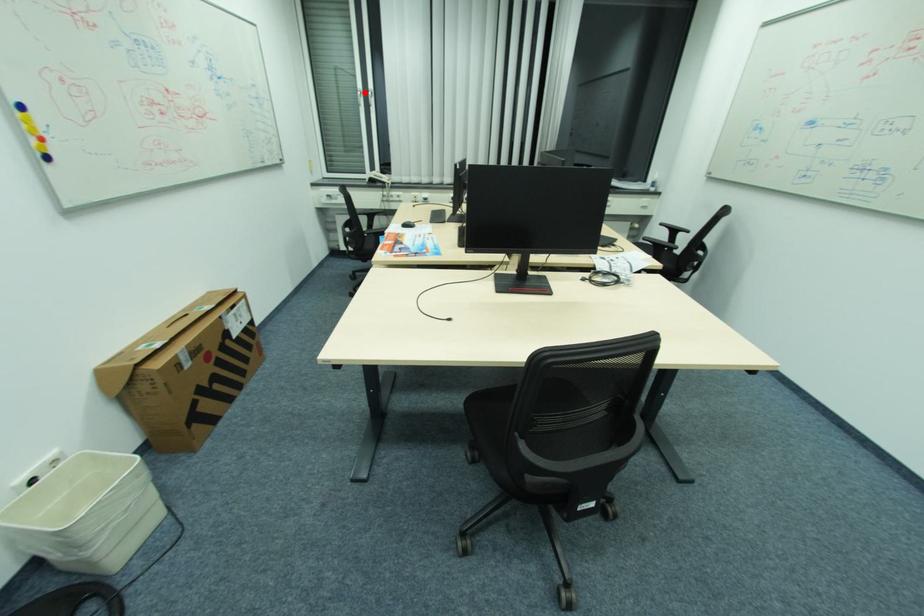
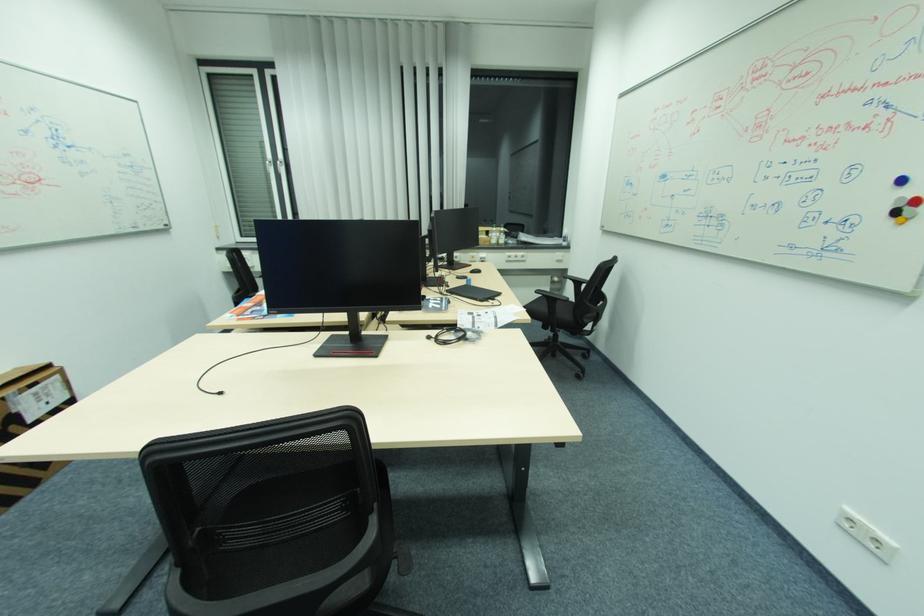
Locate, in the second image, the point that corresponds to the highlighted location in the first image.

(275, 163)